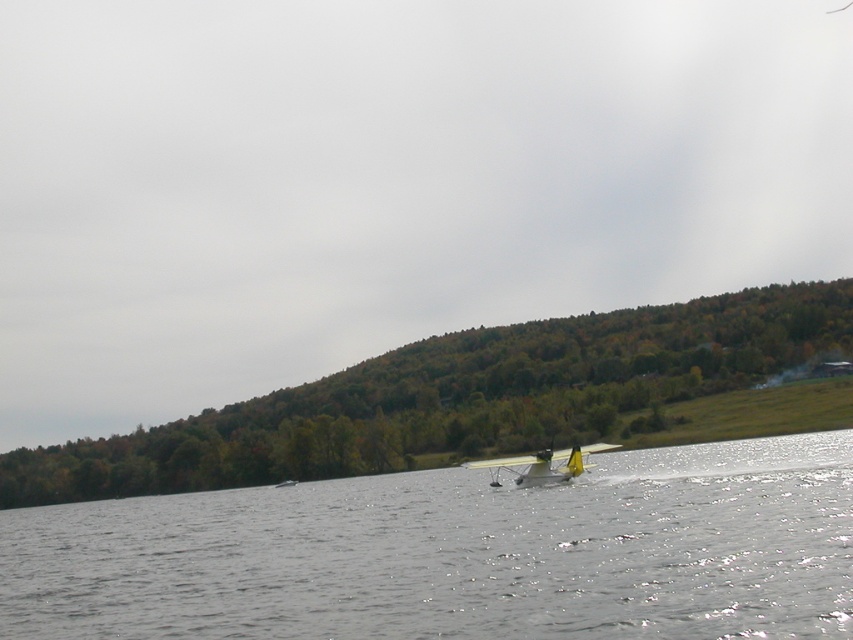
Question: Which point is closer to the camera?

Choices:
 (A) (215, 548)
 (B) (376, 371)
 (C) (497, 481)

Answer: (A)

Question: Is green leafy hillside at center to the right of yellow matte seaplane at center from the viewer's perspective?

Choices:
 (A) no
 (B) yes

Answer: (A)

Question: Where is clear water at center located in relation to yellow matte seaplane at center in the image?

Choices:
 (A) below
 (B) above

Answer: (A)

Question: Among these points, which one is farthest from the camera?

Choices:
 (A) (550, 465)
 (B) (28, 634)

Answer: (A)

Question: Considering the relative positions of green leafy hillside at center and yellow matte seaplane at center in the image provided, where is green leafy hillside at center located with respect to yellow matte seaplane at center?

Choices:
 (A) below
 (B) above

Answer: (A)

Question: Estimate the real-world distances between objects in this image. Which object is closer to the yellow matte seaplane at center?

Choices:
 (A) clear water at center
 (B) green leafy hillside at center

Answer: (A)